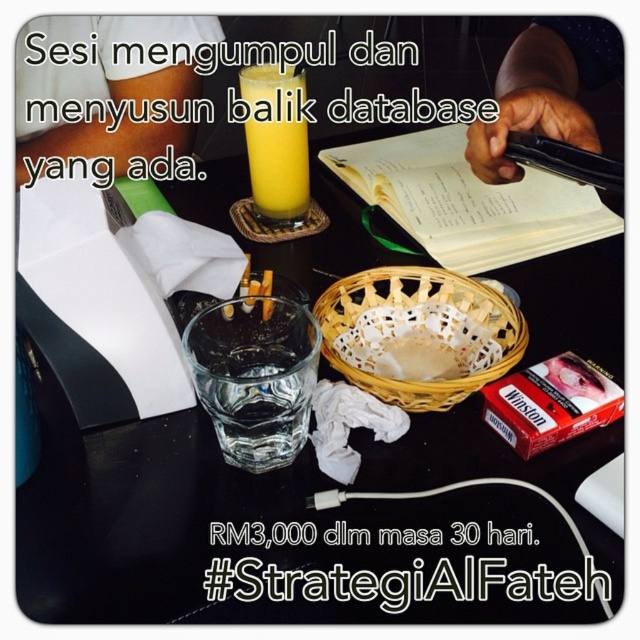
Based on the photo, you are trying to place a small paperweight on the table to secure some loose papers. The point at coordinates [253,376] is where you want to place it. However, there is an object at that location. What is the object at that point?

The point at coordinates [253,376] indicates a transparent glass at center, so the object at that point is the transparent glass.

You have a small toy car that is 3 inches long. You want to place it between the black glass at center and the woven bamboo basket at center. Can it fit without overlapping either object?

The black glass at center and woven bamboo basket at center are 3.92 inches apart. Since the toy car is 3 inches long, it can fit between them without overlapping either object because 3 inches is less than 3.92 inches.

You are organizing items on a table and need to place a new item behind the black glass at center. Which object should you place it behind to ensure it is also behind the woven bamboo basket at center?

Since the black glass at center is in front of the woven bamboo basket at center, placing the new item behind the woven bamboo basket at center will ensure it is also behind the black glass at center.